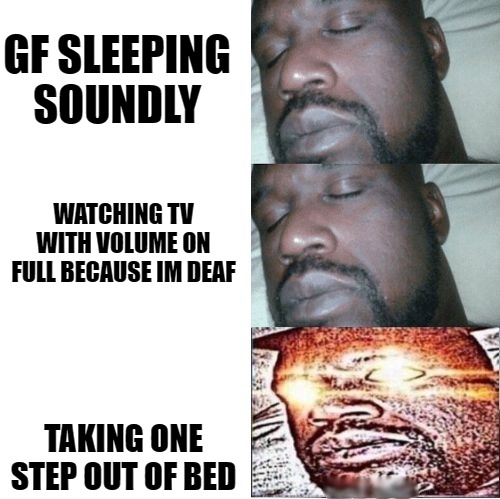
Where is `pillow`? pillow is located at coordinates (467, 96), (465, 200), (496, 339), (276, 467).